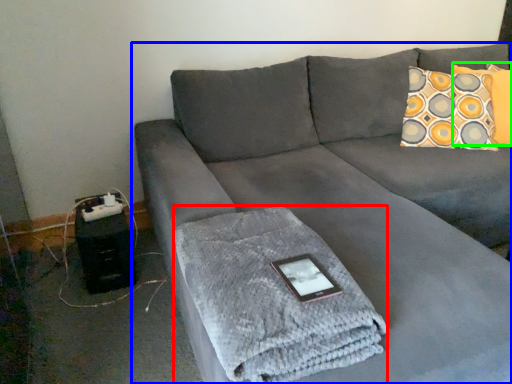
Question: Which is nearer to the bath towel (highlighted by a red box)? studio couch (highlighted by a blue box) or pillow (highlighted by a green box).

Choices:
 (A) studio couch
 (B) pillow

Answer: (A)